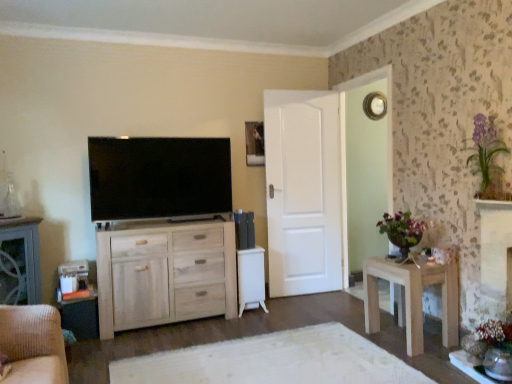
Question: Is flat screen tv at upper left not within white matte door at center?

Choices:
 (A) no
 (B) yes

Answer: (B)

Question: Could you tell me if flat screen tv at upper left is turned towards white matte door at center?

Choices:
 (A) yes
 (B) no

Answer: (B)

Question: Considering the relative sizes of flat screen tv at upper left and white matte door at center in the image provided, is flat screen tv at upper left wider than white matte door at center?

Choices:
 (A) yes
 (B) no

Answer: (A)

Question: From a real-world perspective, is flat screen tv at upper left positioned under white matte door at center based on gravity?

Choices:
 (A) yes
 (B) no

Answer: (B)

Question: From a real-world perspective, is flat screen tv at upper left physically above white matte door at center?

Choices:
 (A) yes
 (B) no

Answer: (A)

Question: Is flat screen tv at upper left bigger than white matte door at center?

Choices:
 (A) no
 (B) yes

Answer: (A)

Question: From a real-world perspective, is flat screen tv at upper left below purple glass vase at upper right?

Choices:
 (A) yes
 (B) no

Answer: (A)

Question: Is flat screen tv at upper left closer to camera compared to purple glass vase at upper right?

Choices:
 (A) no
 (B) yes

Answer: (A)

Question: Considering the relative sizes of flat screen tv at upper left and purple glass vase at upper right in the image provided, is flat screen tv at upper left thinner than purple glass vase at upper right?

Choices:
 (A) yes
 (B) no

Answer: (A)

Question: Does flat screen tv at upper left have a smaller size compared to purple glass vase at upper right?

Choices:
 (A) yes
 (B) no

Answer: (B)

Question: Is flat screen tv at upper left facing towards purple glass vase at upper right?

Choices:
 (A) yes
 (B) no

Answer: (B)

Question: From the image's perspective, would you say flat screen tv at upper left is positioned over purple glass vase at upper right?

Choices:
 (A) yes
 (B) no

Answer: (B)

Question: Is natural wood cabinet at center next to purple glass vase at upper right and touching it?

Choices:
 (A) no
 (B) yes

Answer: (A)